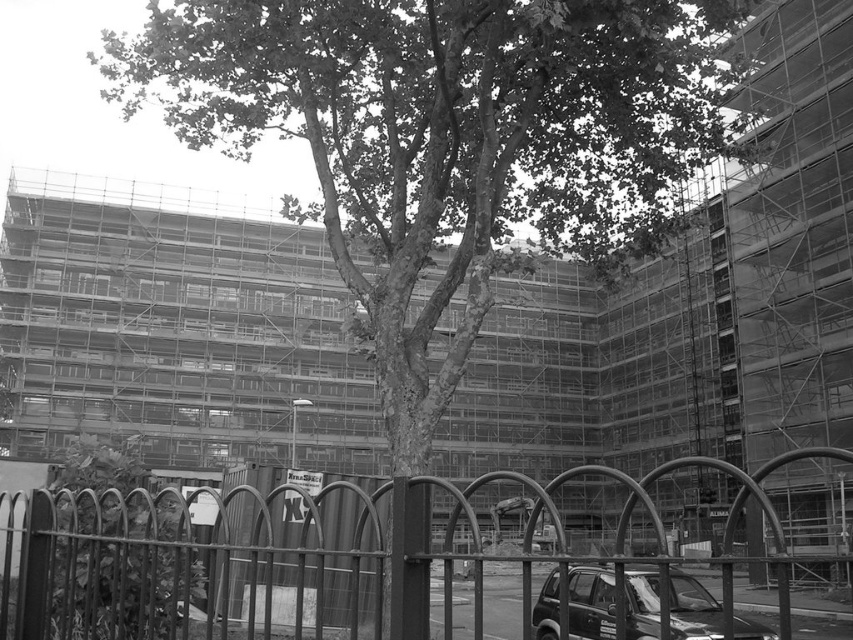
You are a delivery person with a cart that is 10 feet wide. You need to move from the metallic wire fence at lower left to the shiny black suv at lower right. Is there enough space for your cart to pass through the gap between them?

The distance between the metallic wire fence at lower left and the shiny black suv at lower right is 13.10 feet, which is wider than the cart width of 10 feet. Therefore, the cart can pass through the gap between them.

You are standing at the center of the image and want to reach the metallic wire fence at lower left. According to the coordinates provided in the Objects Description, in which direction should you move from your current position?

The metallic wire fence at lower left is located at point coordinates lower left, so you should move towards the lower left direction from the center to reach it.